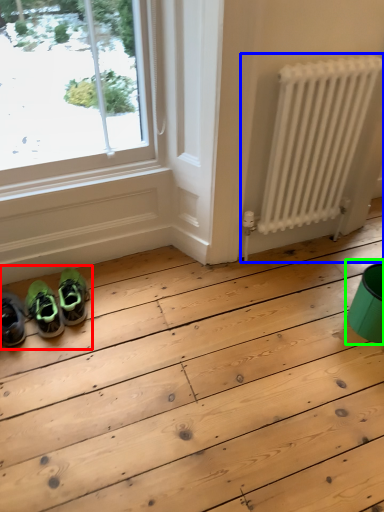
Question: Based on their relative distances, which object is nearer to couple (highlighted by a red box)? Choose from radiator (highlighted by a blue box) and teal (highlighted by a green box).

Choices:
 (A) radiator
 (B) teal

Answer: (A)